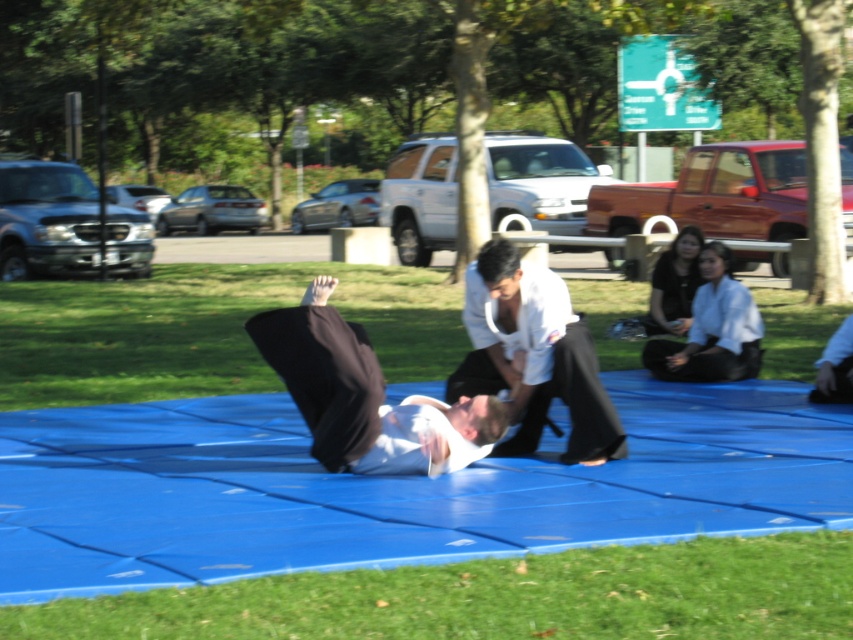
You are a photographer at the martial arts event. You need to capture a closeup shot of both the white matte kimono at center and the white fabric kimono at center. Since your camera can only focus on one at a time, which one should you adjust the focus for first if you want to ensure the wider kimono is in sharp detail?

The white fabric kimono at center is wider than the white matte kimono at center. Therefore, you should focus on the white fabric kimono at center first to ensure its wider area is captured sharply.